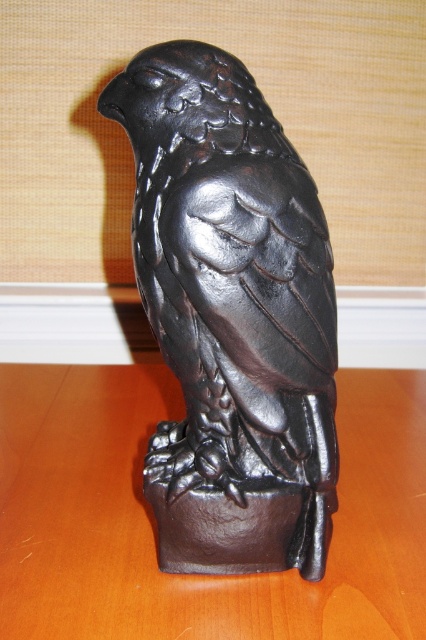
You are an interior designer arranging items on the brown matte table at center. You have a matte black bird at center that you want to place on the table. Considering the table and the bird, which object has a smaller width?

The matte black bird at center has a lesser width compared to the brown matte table at center, so the matte black bird at center is smaller in width.

You are arranging a display and need to place a small vase between the matte black bird at center and the brown matte table at center. Based on their positions, where should the vase be placed?

The matte black bird at center is in front of the brown matte table at center, so the vase should be placed between them along the depth axis, in front of the brown matte table at center and behind the matte black bird at center.